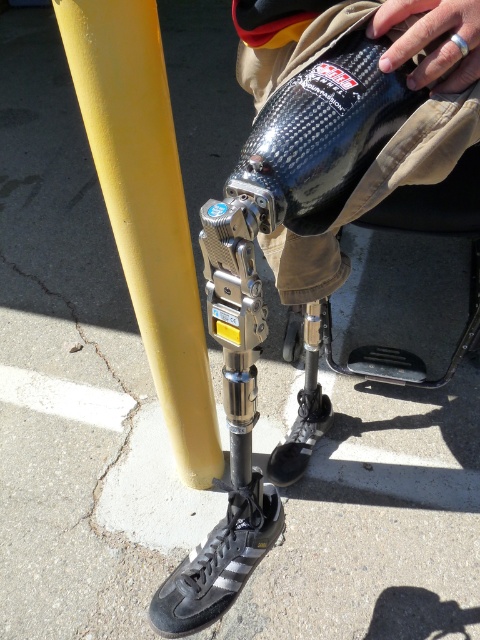
Is point (100, 90) positioned before point (334, 163)?

No.

Can you confirm if yellow matte pole at left is smaller than carbon fiber bottle at center?

Actually, yellow matte pole at left might be larger than carbon fiber bottle at center.

Between point (136, 259) and point (330, 154), which one is positioned in front?

Point (330, 154) is in front.

The image size is (480, 640). I want to click on yellow matte pole at left, so click(145, 209).

Who is shorter, carbon fiber bottle at center or black leather shoe at lower center?

carbon fiber bottle at center

Identify the location of carbon fiber bottle at center. The height and width of the screenshot is (640, 480). (323, 134).

Measure the distance between yellow matte pole at left and camera.

yellow matte pole at left and camera are 28.23 inches apart from each other.

The height and width of the screenshot is (640, 480). Describe the element at coordinates (145, 209) in the screenshot. I see `yellow matte pole at left` at that location.

Identify the location of yellow matte pole at left. The height and width of the screenshot is (640, 480). click(x=145, y=209).